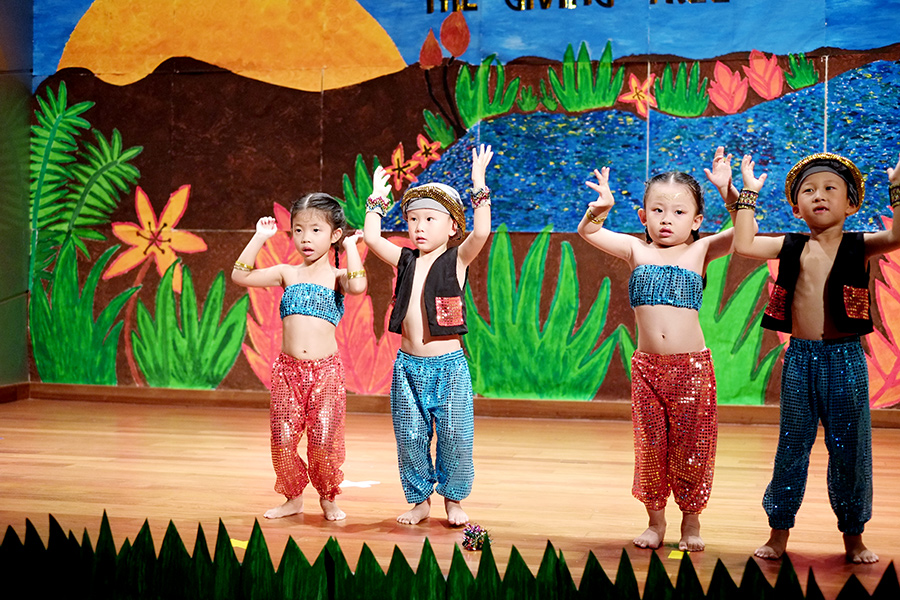
Where is `back drop`? The height and width of the screenshot is (600, 900). back drop is located at coordinates (536, 138).